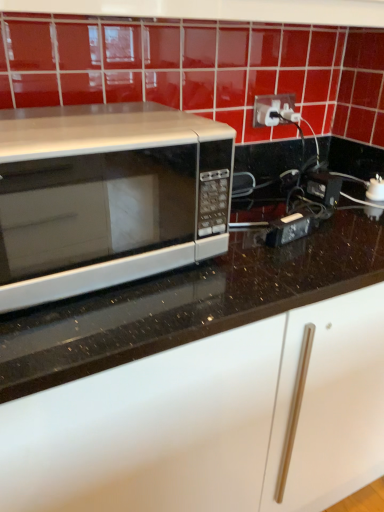
Question: Is satin silver microwave at left at the back of white plastic outlet at upper right?

Choices:
 (A) no
 (B) yes

Answer: (A)

Question: From a real-world perspective, is white plastic outlet at upper right positioned over satin silver microwave at left based on gravity?

Choices:
 (A) yes
 (B) no

Answer: (A)

Question: Is white plastic outlet at upper right positioned before satin silver microwave at left?

Choices:
 (A) no
 (B) yes

Answer: (A)

Question: Is white plastic outlet at upper right outside of satin silver microwave at left?

Choices:
 (A) yes
 (B) no

Answer: (A)

Question: From the image's perspective, is white plastic outlet at upper right on satin silver microwave at left?

Choices:
 (A) yes
 (B) no

Answer: (A)

Question: Can you confirm if white plastic outlet at upper right is smaller than satin silver microwave at left?

Choices:
 (A) yes
 (B) no

Answer: (A)

Question: Considering the relative sizes of satin silver microwave at left and white plastic outlet at upper right in the image provided, is satin silver microwave at left wider than white plastic outlet at upper right?

Choices:
 (A) yes
 (B) no

Answer: (A)

Question: Is satin silver microwave at left at the left side of white plastic outlet at upper right?

Choices:
 (A) no
 (B) yes

Answer: (B)

Question: Does satin silver microwave at left appear on the right side of white plastic outlet at upper right?

Choices:
 (A) yes
 (B) no

Answer: (B)

Question: Considering the relative sizes of satin silver microwave at left and white plastic outlet at upper right in the image provided, is satin silver microwave at left smaller than white plastic outlet at upper right?

Choices:
 (A) no
 (B) yes

Answer: (A)

Question: Considering the relative sizes of satin silver microwave at left and white plastic outlet at upper right in the image provided, is satin silver microwave at left thinner than white plastic outlet at upper right?

Choices:
 (A) yes
 (B) no

Answer: (B)

Question: Can we say satin silver microwave at left lies outside white plastic outlet at upper right?

Choices:
 (A) no
 (B) yes

Answer: (B)

Question: Considering their positions, is white plastic outlet at upper right located in front of or behind satin silver microwave at left?

Choices:
 (A) front
 (B) behind

Answer: (B)